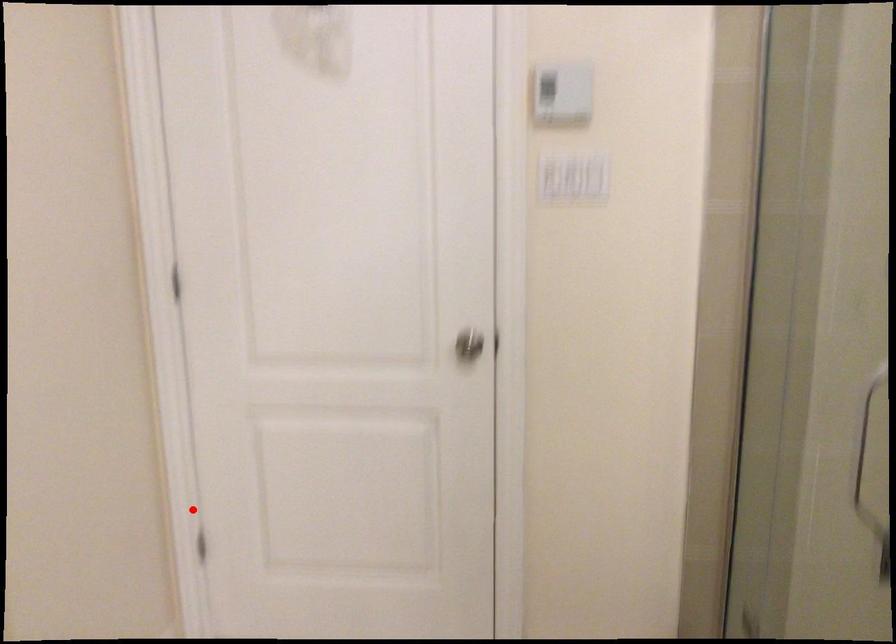
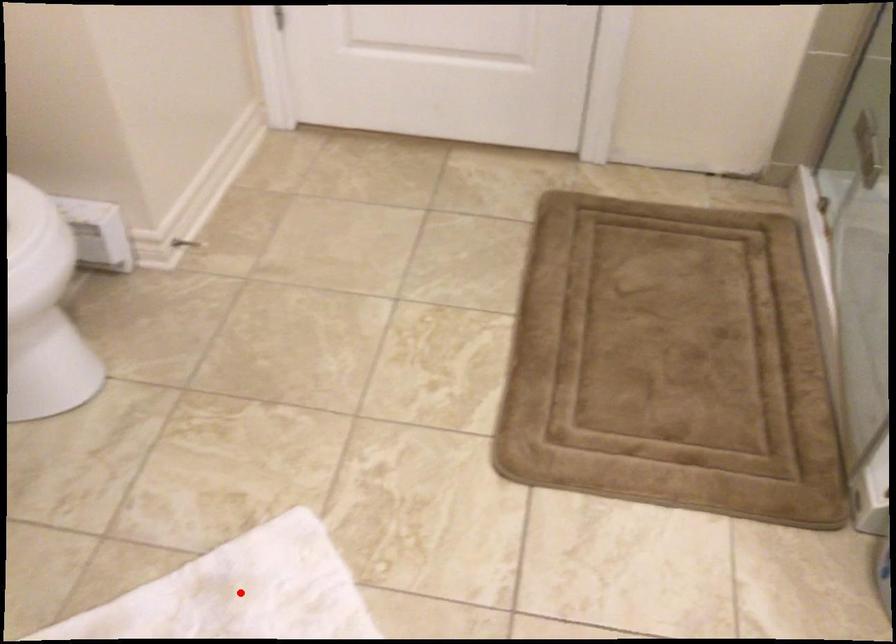
In the scene shown: I am providing you with two images of the same scene from different viewpoints. A red point is marked on the first image and another point is marked on the second image. Is the red point in image1 aligned with the point shown in image2?

No